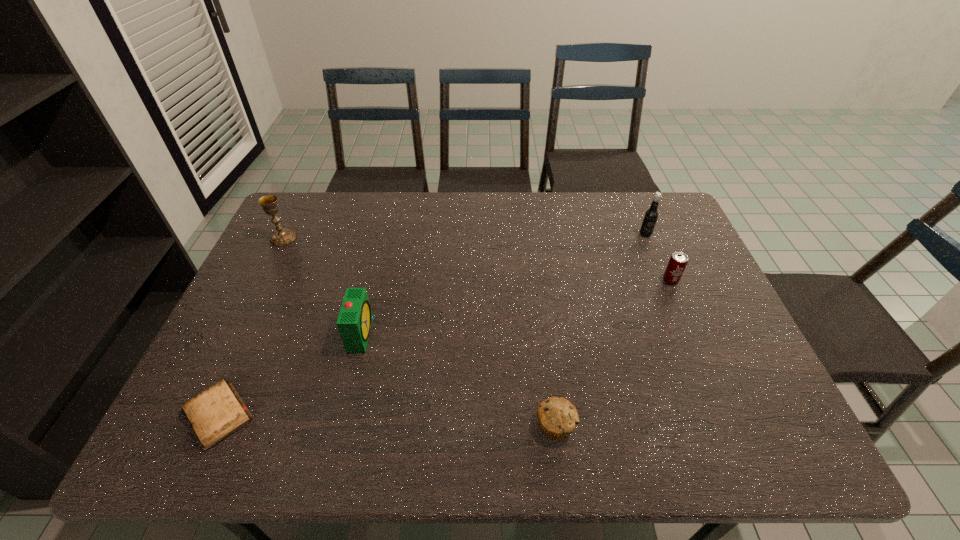
This screenshot has height=540, width=960. I want to click on root beer, so click(651, 215).

At what (x,y) coordinates should I click in order to perform the action: click on chalice. Please return your answer as a coordinate pair (x, y). Looking at the image, I should click on (282, 236).

At what (x,y) coordinates should I click in order to perform the action: click on alarm clock. Please return your answer as a coordinate pair (x, y). This screenshot has height=540, width=960. Looking at the image, I should click on (354, 322).

Image resolution: width=960 pixels, height=540 pixels. Identify the location of the fourth object from right to left. pos(354,322).

Where is `beer can`? Image resolution: width=960 pixels, height=540 pixels. beer can is located at coordinates (678, 261).

You are a GUI agent. You are given a task and a screenshot of the screen. Output one action in this format:
    pyautogui.click(x=<x>, y=<y>)
    Task: Click on the third shortest object
    This screenshot has width=960, height=540.
    Given the screenshot: What is the action you would take?
    pyautogui.click(x=678, y=261)

This screenshot has height=540, width=960. I want to click on muffin, so click(x=557, y=417).

Locate an element on the screen. the third object from right to left is located at coordinates (557, 417).

Locate an element on the screen. The width and height of the screenshot is (960, 540). the shortest object is located at coordinates (218, 412).

You are a GUI agent. You are given a task and a screenshot of the screen. Output one action in this format:
    pyautogui.click(x=<x>, y=<y>)
    Task: Click on the vacant space located on the label of the root beer
    
    Given the screenshot: What is the action you would take?
    pyautogui.click(x=667, y=290)